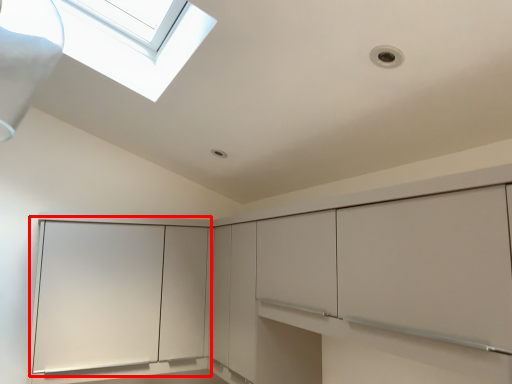
Question: From the image's perspective, where is glass door (annotated by the red box) located relative to cabinetry?

Choices:
 (A) below
 (B) above

Answer: (A)